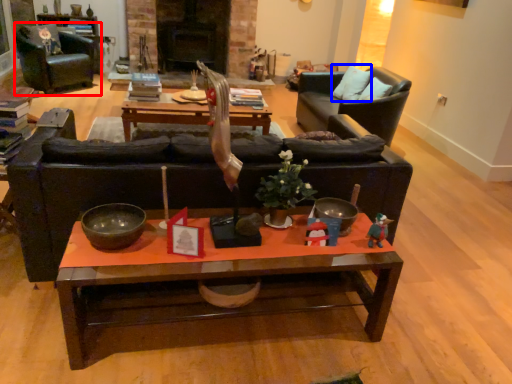
Question: Which point is closer to the camera, chair (highlighted by a red box) or pillow (highlighted by a blue box)?

Choices:
 (A) chair
 (B) pillow

Answer: (B)